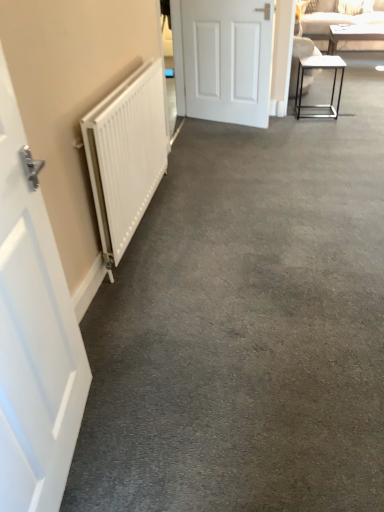
Question: From the image's perspective, would you say metallic frame table at right, which appears as the 2th table when viewed from the top, is shown under white matte door at center, acting as the 1th door starting from the right?

Choices:
 (A) no
 (B) yes

Answer: (B)

Question: Are metallic frame table at right, acting as the 1th table starting from the front, and white matte door at center, the first door positioned from the top, located far from each other?

Choices:
 (A) yes
 (B) no

Answer: (B)

Question: Is metallic frame table at right, marked as the 2th table in a back-to-front arrangement, outside white matte door at center, the first door viewed from the back?

Choices:
 (A) yes
 (B) no

Answer: (A)

Question: From the image's perspective, is metallic frame table at right, marked as the 2th table in a back-to-front arrangement, on top of white matte door at center, the first door positioned from the top?

Choices:
 (A) no
 (B) yes

Answer: (A)

Question: From a real-world perspective, is metallic frame table at right, marked as the 2th table in a back-to-front arrangement, under white matte door at center, placed as the second door when sorted from bottom to top?

Choices:
 (A) no
 (B) yes

Answer: (B)

Question: Can you confirm if metallic frame table at right, the first table viewed from the left, is taller than white matte door at center, the first door positioned from the top?

Choices:
 (A) no
 (B) yes

Answer: (A)

Question: Does beige fabric couch at upper right have a lesser height compared to white glossy table at upper right, the 1th table when ordered from back to front?

Choices:
 (A) no
 (B) yes

Answer: (A)

Question: Can you confirm if beige fabric couch at upper right is positioned to the left of white glossy table at upper right, which is the 2th table from bottom to top?

Choices:
 (A) yes
 (B) no

Answer: (A)

Question: Can you confirm if beige fabric couch at upper right is bigger than white glossy table at upper right, which is counted as the first table, starting from the top?

Choices:
 (A) yes
 (B) no

Answer: (A)

Question: From a real-world perspective, is beige fabric couch at upper right over white glossy table at upper right, which is counted as the first table, starting from the top?

Choices:
 (A) yes
 (B) no

Answer: (A)

Question: Is beige fabric couch at upper right positioned with its back to white glossy table at upper right, the 2th table positioned from the front?

Choices:
 (A) yes
 (B) no

Answer: (B)

Question: Can white glossy table at upper right, the 1th table when ordered from back to front, be found inside beige fabric couch at upper right?

Choices:
 (A) no
 (B) yes

Answer: (B)

Question: From the image's perspective, is white matte door at left, which is the 2th door in back-to-front order, on top of white glossy table at upper right, the 2th table positioned from the front?

Choices:
 (A) no
 (B) yes

Answer: (A)